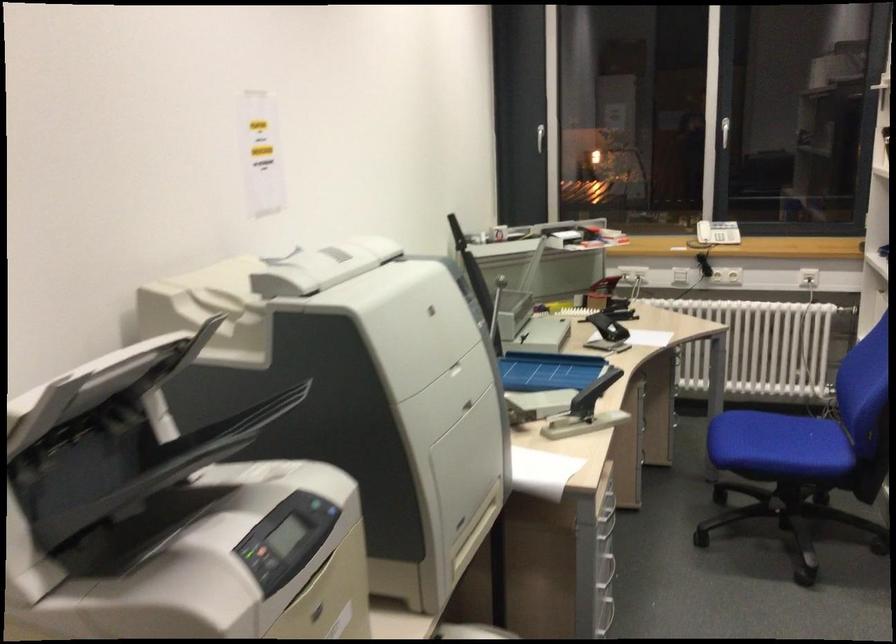
What do you see at coordinates (586, 410) in the screenshot?
I see `the telephone handset` at bounding box center [586, 410].